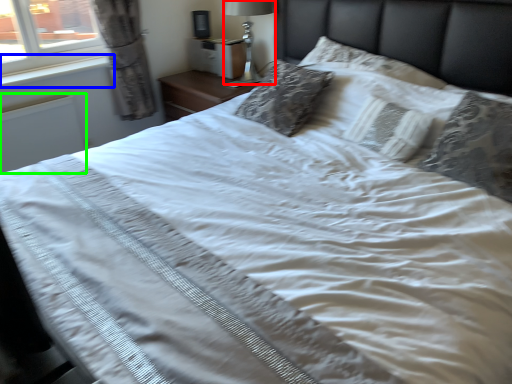
Question: Which object is the farthest from bedside lamp (highlighted by a red box)? Choose among these: window sill (highlighted by a blue box) or radiator (highlighted by a green box).

Choices:
 (A) window sill
 (B) radiator

Answer: (B)